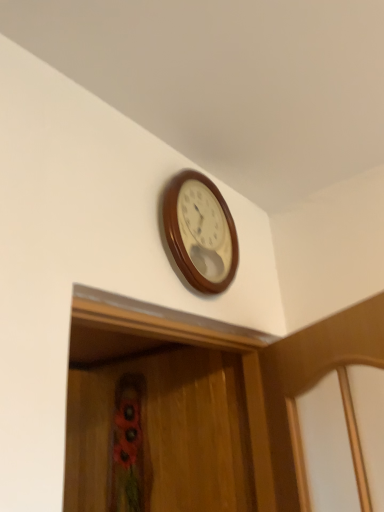
Locate an element on the screen. wooden wall clock at upper center is located at coordinates (200, 232).

The width and height of the screenshot is (384, 512). Describe the element at coordinates (200, 232) in the screenshot. I see `wooden wall clock at upper center` at that location.

Locate an element on the screen. The image size is (384, 512). wooden wall clock at upper center is located at coordinates (200, 232).